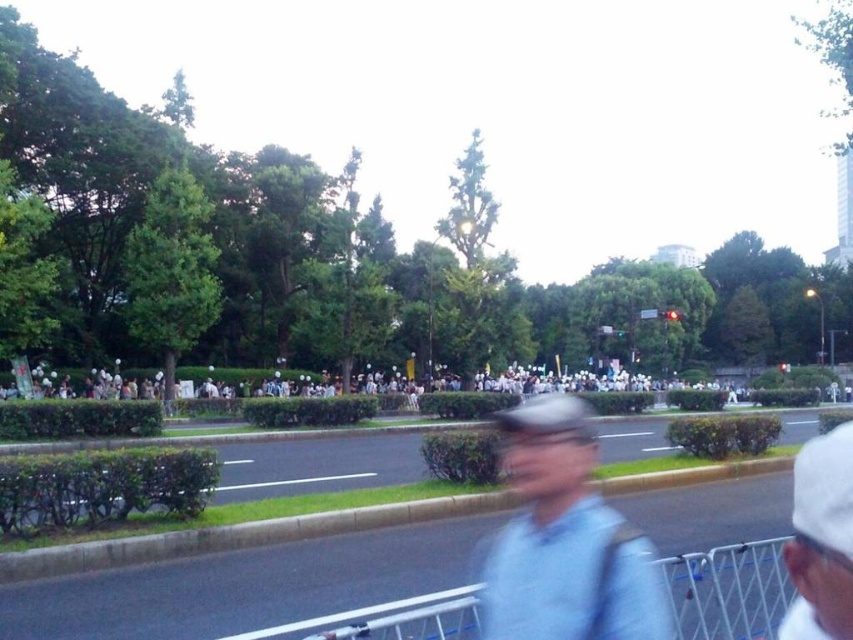
Question: Can you confirm if light blue fabric at center is positioned to the left of white metal rail at lower center?

Choices:
 (A) no
 (B) yes

Answer: (A)

Question: Among these points, which one is nearest to the camera?

Choices:
 (A) (523, 486)
 (B) (397, 611)

Answer: (A)

Question: Among these points, which one is nearest to the camera?

Choices:
 (A) (366, 628)
 (B) (828, 548)

Answer: (B)

Question: Is light blue fabric at center to the left of white matte cap at upper right from the viewer's perspective?

Choices:
 (A) yes
 (B) no

Answer: (A)

Question: Which is nearer to the white metal rail at lower center?

Choices:
 (A) light blue fabric at center
 (B) white matte cap at upper right

Answer: (B)

Question: Is the position of white metal rail at lower center less distant than that of white matte cap at upper right?

Choices:
 (A) yes
 (B) no

Answer: (B)